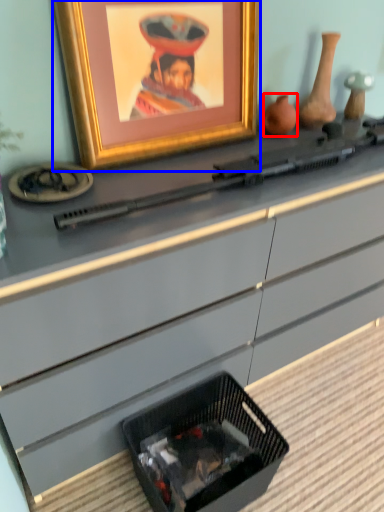
Question: Which object appears farthest to the camera in this image, vase (highlighted by a red box) or picture frame (highlighted by a blue box)?

Choices:
 (A) vase
 (B) picture frame

Answer: (A)